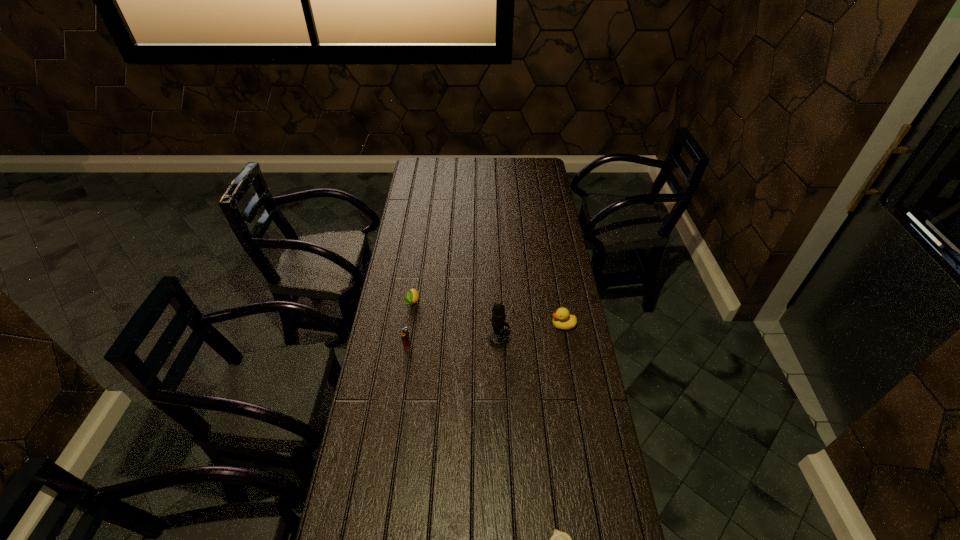
What are the coordinates of `vacant space located 0.270m at the beak of the duck` in the screenshot? It's located at (480, 325).

Locate an element on the screen. vacant region located with leaves positioned above the taller lemon is located at coordinates (403, 362).

This screenshot has width=960, height=540. Find the location of `igniter at the left edge`. igniter at the left edge is located at coordinates (405, 334).

In order to click on lemon that is positioned at the left edge in this screenshot , I will do `click(412, 296)`.

Where is `object present at the right edge`? The height and width of the screenshot is (540, 960). object present at the right edge is located at coordinates (562, 320).

The height and width of the screenshot is (540, 960). Find the location of `vacant space at the far edge`. vacant space at the far edge is located at coordinates (499, 164).

At what (x,y) coordinates should I click in order to perform the action: click on free region at the left edge of the desktop. Please return your answer as a coordinate pair (x, y). Looking at the image, I should click on (415, 268).

In the image, there is a desktop. Where is `free space at the right edge`? This screenshot has height=540, width=960. free space at the right edge is located at coordinates (574, 485).

The width and height of the screenshot is (960, 540). What are the coordinates of `vacant area at the far right corner` in the screenshot? It's located at (532, 178).

Where is `vacant space that is in between the third object from right to left and the taller lemon`? The height and width of the screenshot is (540, 960). vacant space that is in between the third object from right to left and the taller lemon is located at coordinates (455, 321).